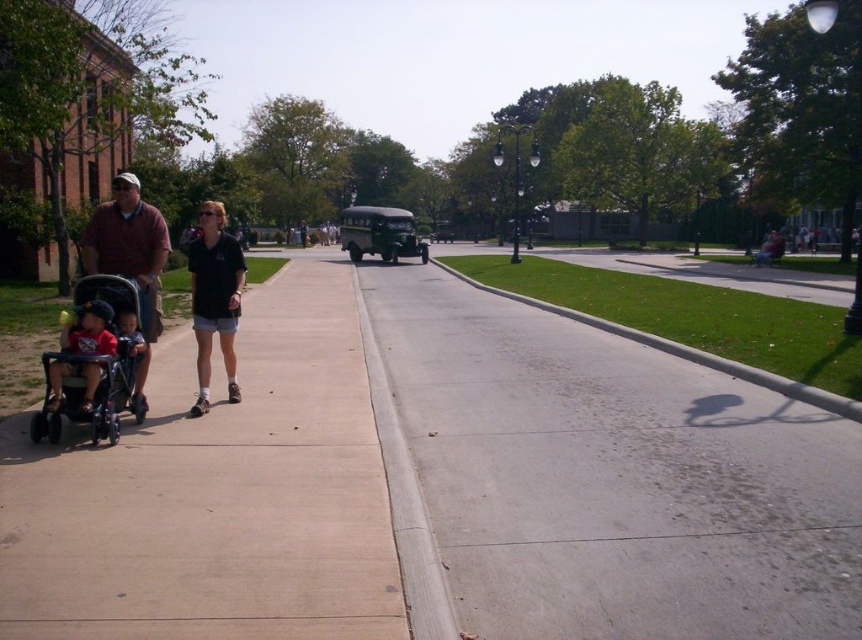
Is gray concrete sidewalk at center positioned before smooth concrete sidewalk at left?

That is False.

Who is taller, gray concrete sidewalk at center or smooth concrete sidewalk at left?

smooth concrete sidewalk at left is taller.

Image resolution: width=862 pixels, height=640 pixels. In order to click on gray concrete sidewalk at center in this screenshot , I will do `click(611, 477)`.

Identify the location of gray concrete sidewalk at center. This screenshot has height=640, width=862. (611, 477).

Is smooth concrete sidewalk at left in front of matte black baby stroller at left?

Yes, it is in front of matte black baby stroller at left.

Is point (64, 497) in front of point (78, 332)?

That is True.

Looking at this image, who is more distant from viewer, (157, 563) or (114, 333)?

Positioned behind is point (114, 333).

You are a GUI agent. You are given a task and a screenshot of the screen. Output one action in this format:
    pyautogui.click(x=<x>, y=<y>)
    Task: Click on the smooth concrete sidewalk at left
    The image size is (862, 640).
    Given the screenshot: What is the action you would take?
    pyautogui.click(x=217, y=496)

Between smooth concrete sidewalk at left and matte blue shirt at left, which one is positioned lower?

Positioned lower is smooth concrete sidewalk at left.

Consider the image. Can you confirm if smooth concrete sidewalk at left is positioned to the left of matte blue shirt at left?

No, smooth concrete sidewalk at left is not to the left of matte blue shirt at left.

Does point (97, 618) come closer to viewer compared to point (147, 353)?

Yes, point (97, 618) is closer to viewer.

You are a GUI agent. You are given a task and a screenshot of the screen. Output one action in this format:
    pyautogui.click(x=<x>, y=<y>)
    Task: Click on the smooth concrete sidewalk at left
    This screenshot has width=862, height=640.
    Given the screenshot: What is the action you would take?
    pyautogui.click(x=217, y=496)